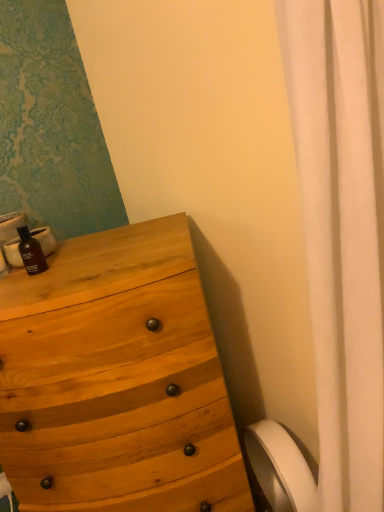
Question: Looking at their shapes, would you say matte black bottle at left is wider or thinner than natural wood chest of drawers at left?

Choices:
 (A) wide
 (B) thin

Answer: (B)

Question: Which is correct: matte black bottle at left is inside natural wood chest of drawers at left, or outside of it?

Choices:
 (A) outside
 (B) inside

Answer: (A)

Question: Estimate the real-world distances between objects in this image. Which object is farther from the natural wood chest of drawers at left?

Choices:
 (A) matte black bottle at left
 (B) white matte toilet paper at lower right

Answer: (B)

Question: Estimate the real-world distances between objects in this image. Which object is farther from the natural wood chest of drawers at left?

Choices:
 (A) white matte toilet paper at lower right
 (B) matte black bottle at left

Answer: (A)